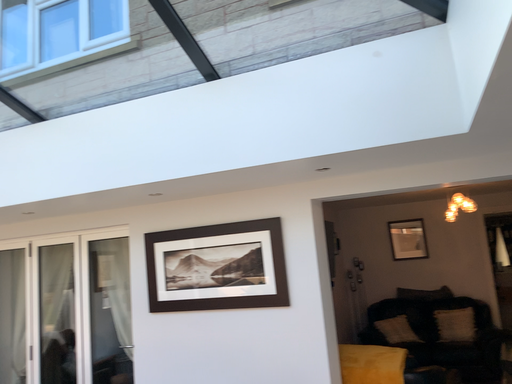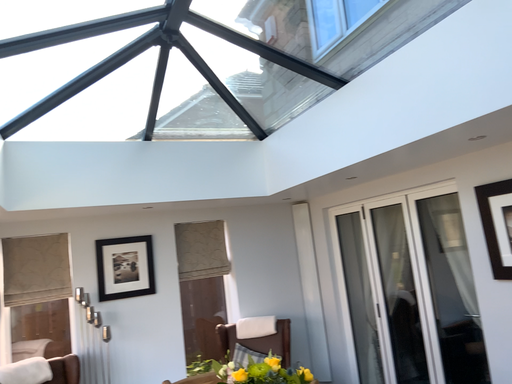
Question: How did the camera likely rotate when shooting the video?

Choices:
 (A) rotated right
 (B) rotated left

Answer: (B)